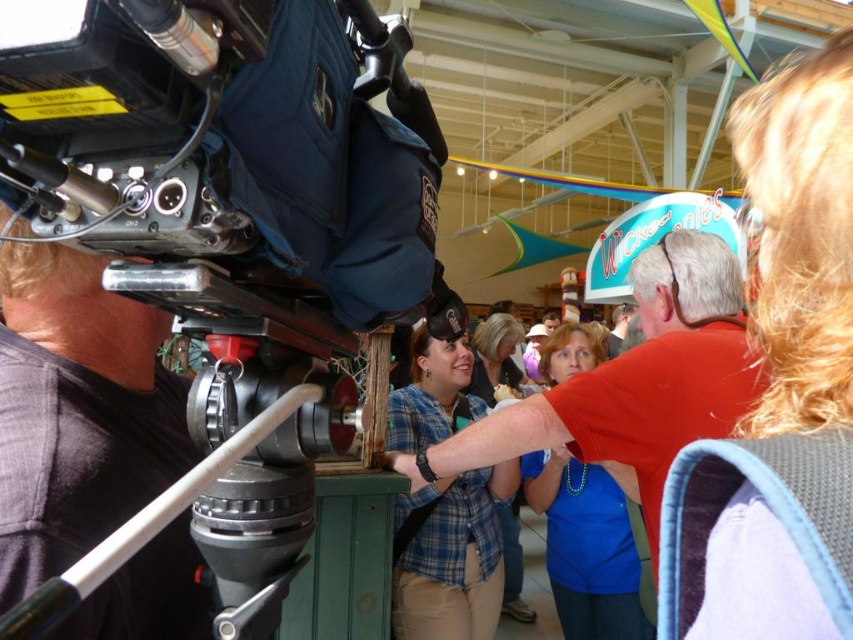
You are standing at a fair and want to take a photo of the machinery. The camera you have can only focus on objects within 18 inches. Is the point at coordinates point (732, 486) within the camera focus range?

The point at coordinates point (732, 486) is 17.96 inches away from the camera, which is within the 18 inches focus range. Therefore, the camera can focus on it.

From the picture: You are at an event and want to locate the person with the blue plaid shirt at center. Which direction should you look relative to the blonde hair at upper right?

The blonde hair at upper right is above the blue plaid shirt at center, so you should look downward from the blonde hair at upper right to find the blue plaid shirt at center.

You are standing in front of the machinery and want to take a photo of the white plastic tripod at center without the blonde hair at upper right blocking the view. Is this possible?

The blonde hair at upper right is closer to the viewer than the white plastic tripod at center, so it will block the view of the white plastic tripod at center. You need to move to a position where the blonde hair at upper right is not in front of the tripod.